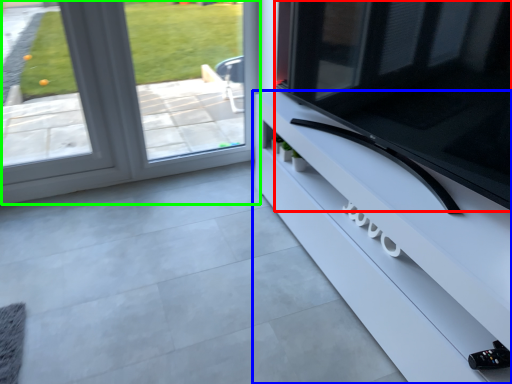
Question: Which is nearer to the television (highlighted by a red box)? furniture (highlighted by a blue box) or window (highlighted by a green box).

Choices:
 (A) furniture
 (B) window

Answer: (A)